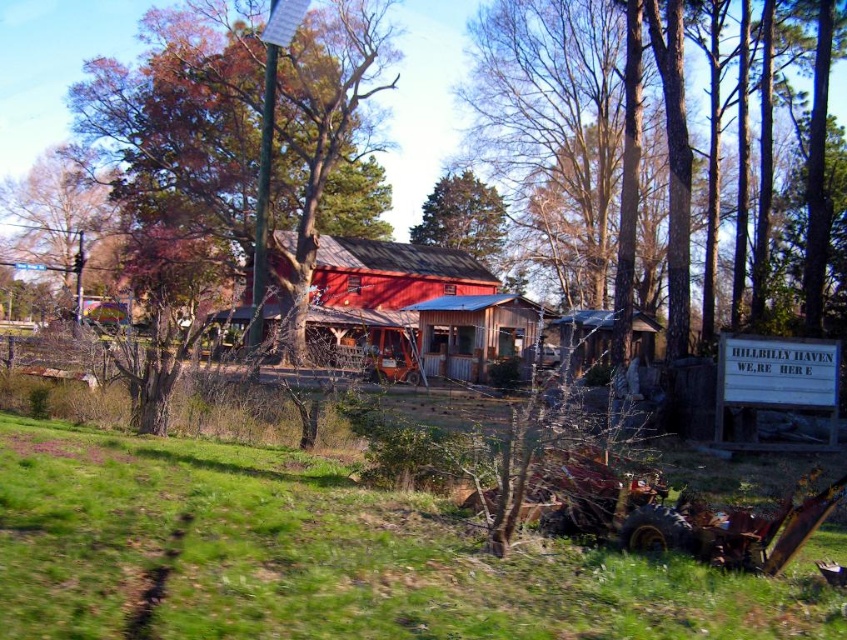
Question: Is wooden shack at center below rustic wood hut at center?

Choices:
 (A) no
 (B) yes

Answer: (A)

Question: Does brown textured tree at upper left appear over rustic wood hut at center?

Choices:
 (A) yes
 (B) no

Answer: (A)

Question: Can you confirm if rustic wood cabin at center is thinner than wooden shack at center?

Choices:
 (A) yes
 (B) no

Answer: (B)

Question: Which point is farther from the camera taking this photo?

Choices:
 (A) (446, 289)
 (B) (596, 356)
 (C) (482, 248)
 (D) (76, 250)

Answer: (D)

Question: Estimate the real-world distances between objects in this image. Which object is farther from the brown textured tree at upper left?

Choices:
 (A) rustic wood cabin at center
 (B) green textured pine tree at upper center
 (C) smooth bark tree at center
 (D) rustic wood hut at center

Answer: (D)

Question: Which of the following is the farthest from the observer?

Choices:
 (A) rustic wood cabin at center
 (B) green textured pine tree at upper center

Answer: (B)